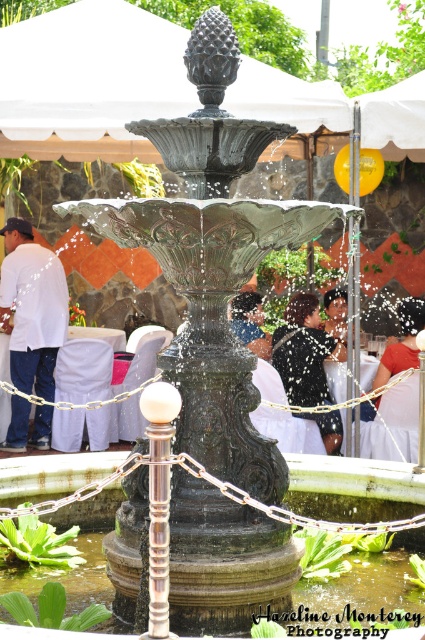
You are at an outdoor event and see the white fabric canopy at upper center and the dark brown hair at center. Which object is wider?

The white fabric canopy at upper center is wider than the dark brown hair at center.

You are standing at the edge of the fountain and see a person at the center wearing a matte black shirt at center and with dark brown hair at center. From your perspective, which object is closer to the ground?

The matte black shirt at center is closer to the ground because it is below the dark brown hair at center.

You are at an outdoor event and see the white fabric canopy at upper center and the dark brown hair at center. Which object is closer to you?

The white fabric canopy at upper center is closer to you because it is in front of the dark brown hair at center.